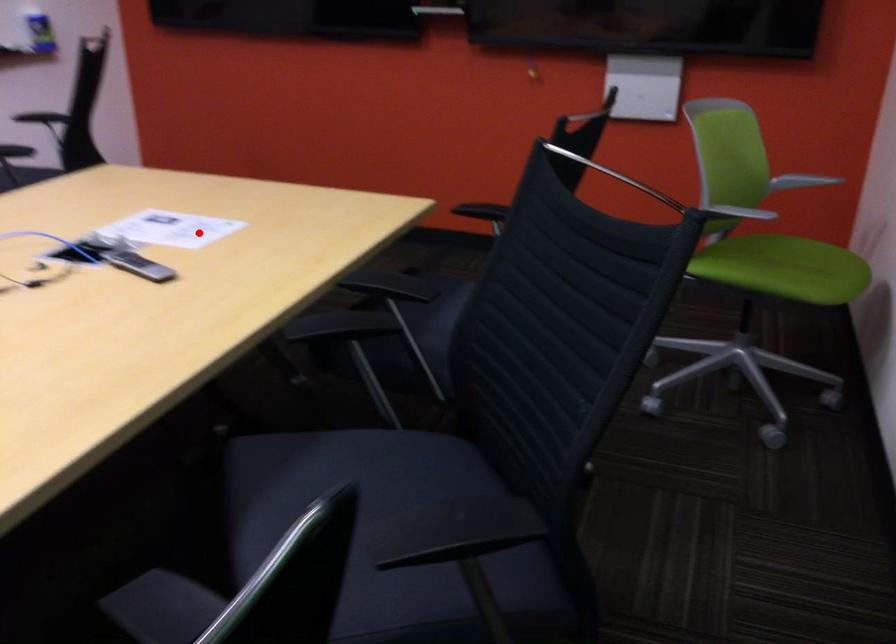
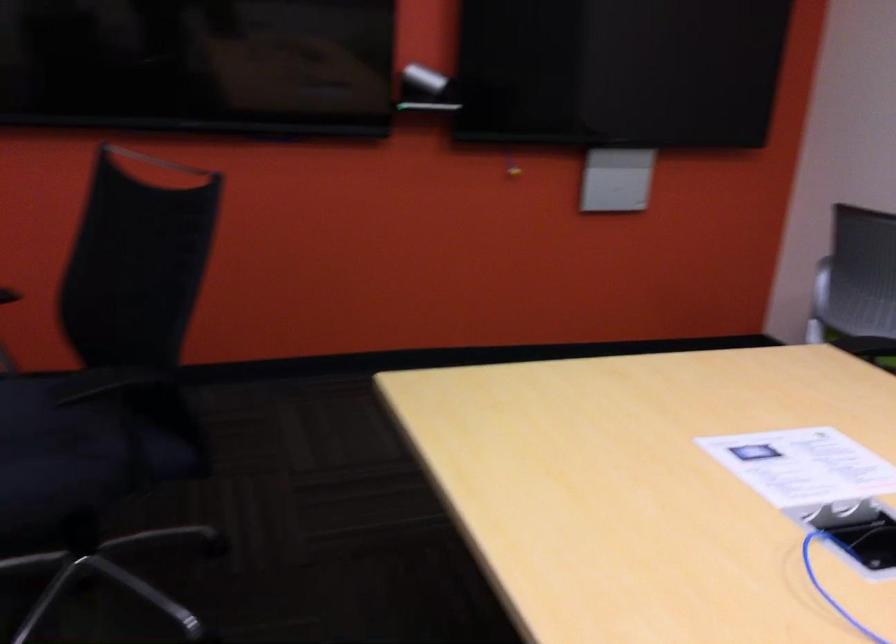
Question: A red point is marked in image1. In image2, is the corresponding 3D point closer to the camera or farther? Reply with the corresponding letter.

Choices:
 (A) The corresponding 3D point is closer.
 (B) The corresponding 3D point is farther.

Answer: (A)